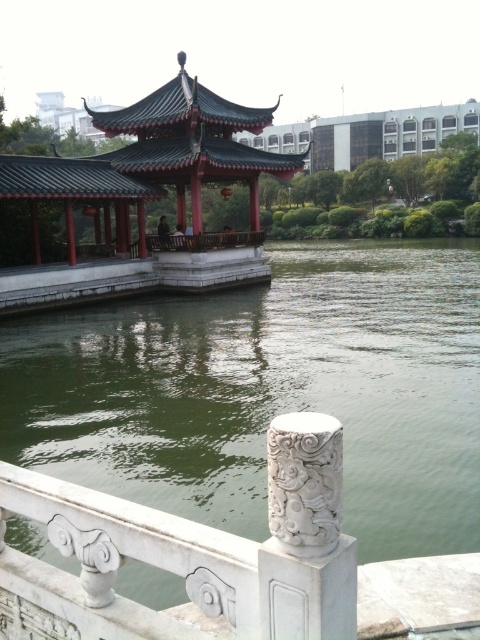
Question: Does green stone water at center appear on the left side of shiny red gazebo at center?

Choices:
 (A) yes
 (B) no

Answer: (B)

Question: Is green stone water at center bigger than shiny red gazebo at center?

Choices:
 (A) no
 (B) yes

Answer: (A)

Question: Does green stone water at center appear over shiny red gazebo at center?

Choices:
 (A) yes
 (B) no

Answer: (B)